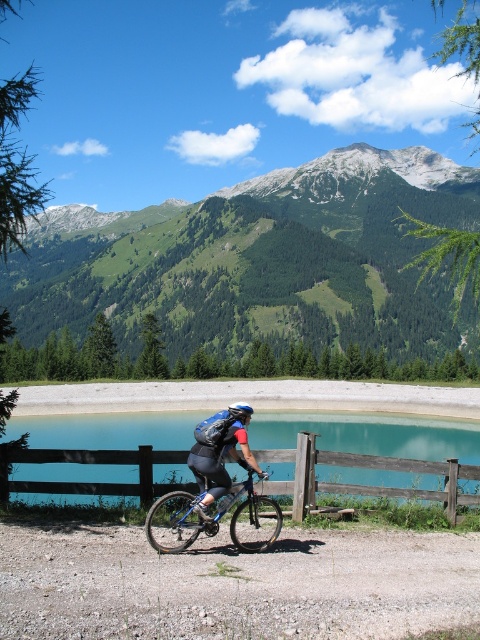
Question: Which point appears farthest from the camera in this image?

Choices:
 (A) (190, 461)
 (B) (244, 417)
 (C) (107, 483)
 (D) (249, 532)

Answer: (C)

Question: Is dirt gravel at lower center positioned before blue matte helmet at center?

Choices:
 (A) no
 (B) yes

Answer: (B)

Question: Which point is closer to the camera?

Choices:
 (A) (214, 508)
 (B) (245, 419)

Answer: (A)

Question: Is blue metallic bicycle at center above matte blue helmet at center?

Choices:
 (A) yes
 (B) no

Answer: (A)

Question: Which point is farther to the camera?

Choices:
 (A) (276, 484)
 (B) (27, 636)
 (C) (223, 420)
 (D) (162, 506)

Answer: (A)

Question: In this image, where is blue metallic bicycle at center located relative to blue matte helmet at center?

Choices:
 (A) right
 (B) left

Answer: (B)